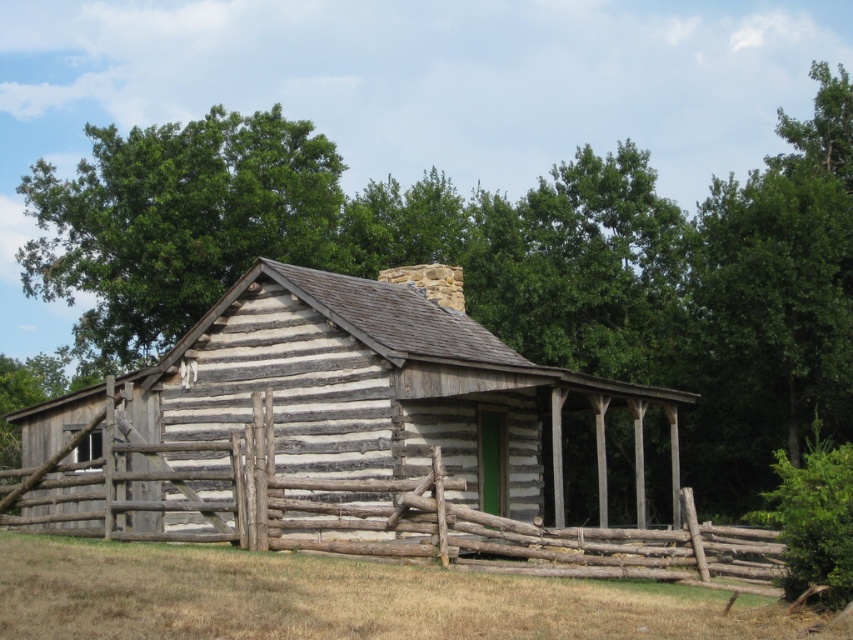
Question: Which point is closer to the camera?

Choices:
 (A) green leafy tree at upper center
 (B) brown wooden fence at lower center
 (C) weathered wood fence at lower center

Answer: (B)

Question: Is weathered wood cabin at center above green leafy tree at upper left?

Choices:
 (A) yes
 (B) no

Answer: (B)

Question: Does weathered wood fence at lower center come behind green leafy tree at upper left?

Choices:
 (A) no
 (B) yes

Answer: (A)

Question: Which point appears closest to the camera in this image?

Choices:
 (A) (619, 611)
 (B) (231, 240)
 (C) (631, 561)
 (D) (589, 476)

Answer: (A)

Question: Is weathered wood cabin at center further to camera compared to weathered wood fence at lower center?

Choices:
 (A) yes
 (B) no

Answer: (A)

Question: Which point appears farthest from the camera in this image?

Choices:
 (A) (390, 240)
 (B) (642, 634)
 (C) (584, 540)

Answer: (A)